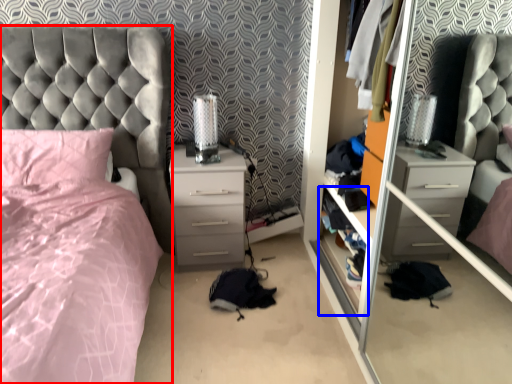
Question: Among these objects, which one is farthest to the camera, bed (highlighted by a red box) or shelf (highlighted by a blue box)?

Choices:
 (A) bed
 (B) shelf

Answer: (B)